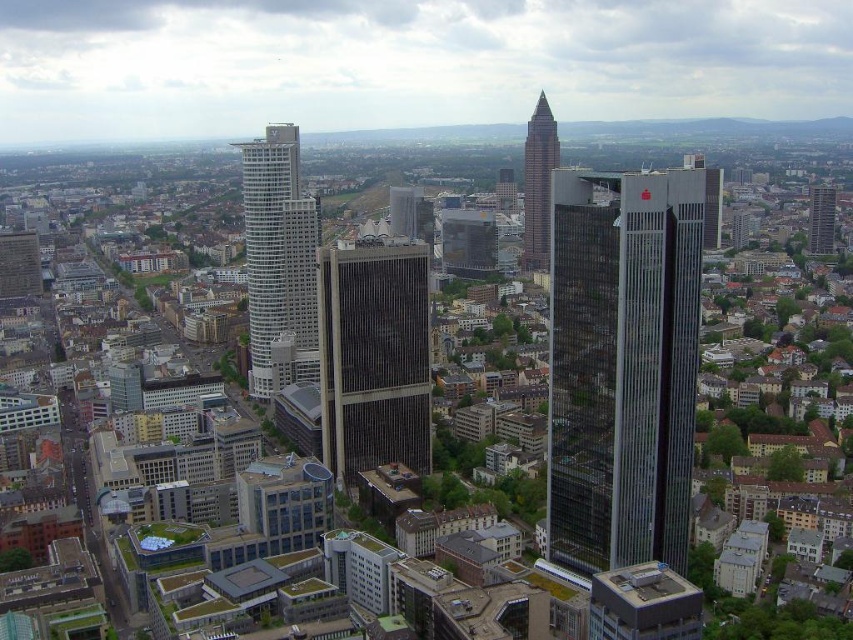
Question: Can you confirm if glassy gray skyscraper at center is thinner than glassy brown skyscraper at center?

Choices:
 (A) no
 (B) yes

Answer: (A)

Question: Which point is farther to the camera?

Choices:
 (A) silver glass skyscraper at center-left
 (B) glassy gray skyscraper at center
 (C) dark gray glass skyscraper at center
 (D) glassy brown skyscraper at center

Answer: (D)

Question: Is silver glass skyscraper at center-left bigger than gray glass skyscraper at upper right?

Choices:
 (A) yes
 (B) no

Answer: (B)

Question: Can you confirm if dark gray glass skyscraper at center is positioned above glassy brown skyscraper at center?

Choices:
 (A) yes
 (B) no

Answer: (B)

Question: Which point appears farthest from the camera in this image?

Choices:
 (A) pyautogui.click(x=688, y=301)
 (B) pyautogui.click(x=280, y=305)

Answer: (B)

Question: Which object is positioned closest to the dark gray glass skyscraper at center?

Choices:
 (A) silver glass skyscraper at center-left
 (B) gray glass skyscraper at upper right

Answer: (A)